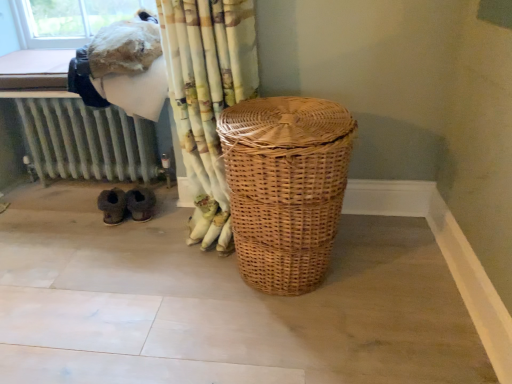
Question: Considering the relative sizes of patterned fabric curtain at center and metallic radiator at lower left in the image provided, is patterned fabric curtain at center wider than metallic radiator at lower left?

Choices:
 (A) yes
 (B) no

Answer: (B)

Question: Is patterned fabric curtain at center thinner than metallic radiator at lower left?

Choices:
 (A) yes
 (B) no

Answer: (A)

Question: Is patterned fabric curtain at center to the right of metallic radiator at lower left from the viewer's perspective?

Choices:
 (A) no
 (B) yes

Answer: (B)

Question: Can you confirm if patterned fabric curtain at center is smaller than metallic radiator at lower left?

Choices:
 (A) yes
 (B) no

Answer: (B)

Question: Is patterned fabric curtain at center positioned in front of metallic radiator at lower left?

Choices:
 (A) no
 (B) yes

Answer: (B)

Question: Is patterned fabric curtain at center oriented away from metallic radiator at lower left?

Choices:
 (A) no
 (B) yes

Answer: (A)

Question: From the image's perspective, is metallic radiator at lower left on top of brown suede slippers at lower left?

Choices:
 (A) yes
 (B) no

Answer: (A)

Question: Could you tell me if metallic radiator at lower left is turned towards brown suede slippers at lower left?

Choices:
 (A) no
 (B) yes

Answer: (A)

Question: Is metallic radiator at lower left with brown suede slippers at lower left?

Choices:
 (A) yes
 (B) no

Answer: (B)

Question: Can you confirm if metallic radiator at lower left is thinner than brown suede slippers at lower left?

Choices:
 (A) no
 (B) yes

Answer: (A)

Question: Is metallic radiator at lower left positioned far away from brown suede slippers at lower left?

Choices:
 (A) no
 (B) yes

Answer: (A)

Question: Can you confirm if metallic radiator at lower left is smaller than brown suede slippers at lower left?

Choices:
 (A) yes
 (B) no

Answer: (B)

Question: Can you confirm if brown suede slippers at lower left is shorter than woven brown laundry basket at center?

Choices:
 (A) no
 (B) yes

Answer: (B)